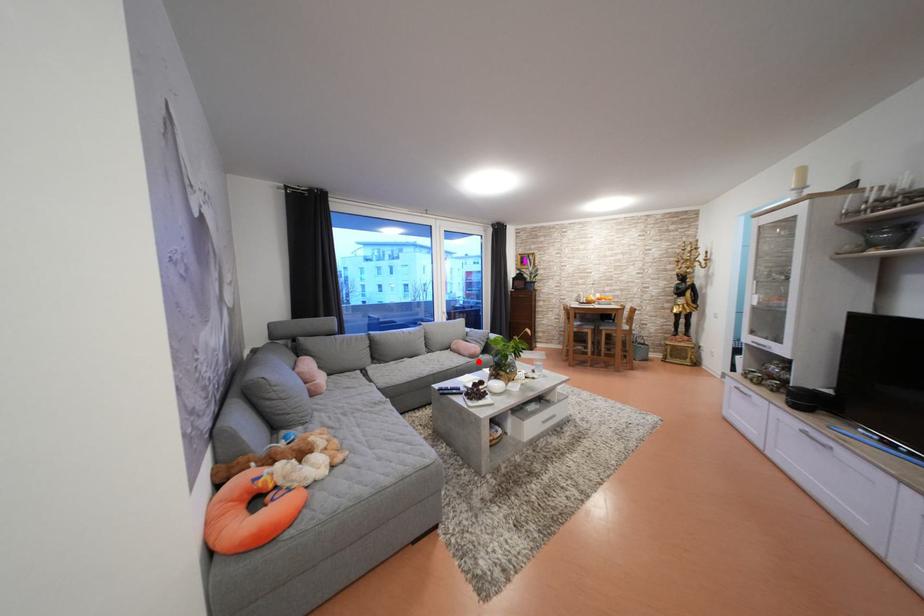
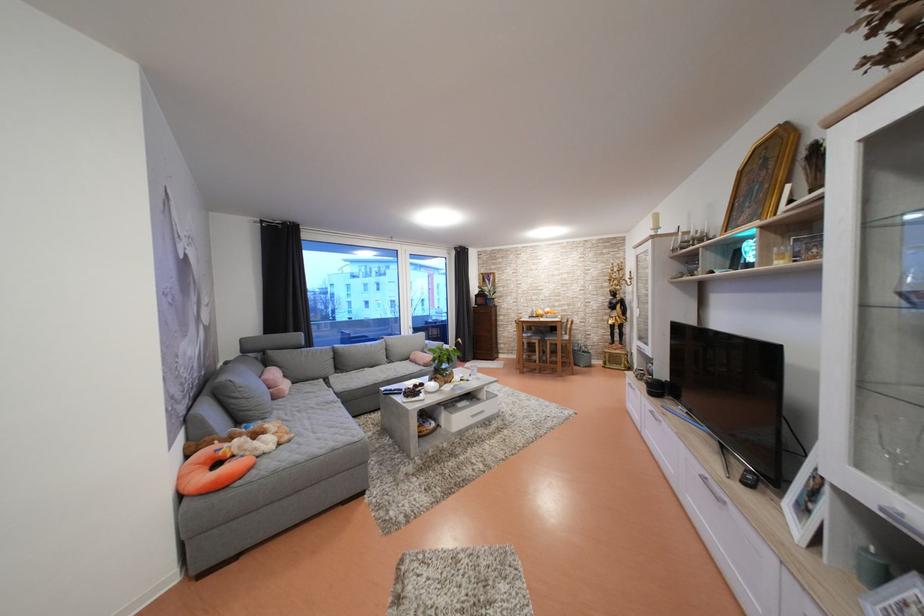
Where in the second image is the point corresponding to the highlighted location from the first image?

(432, 370)